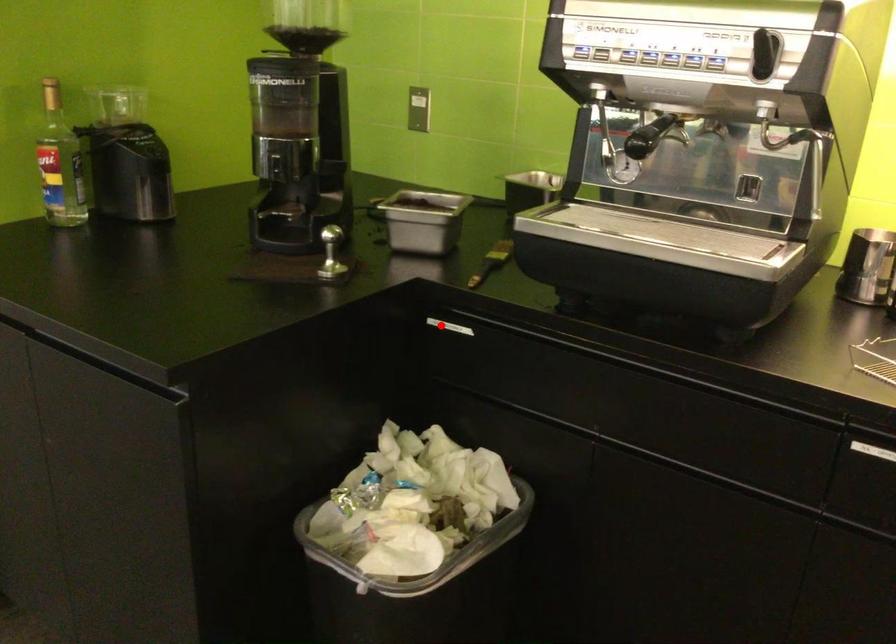
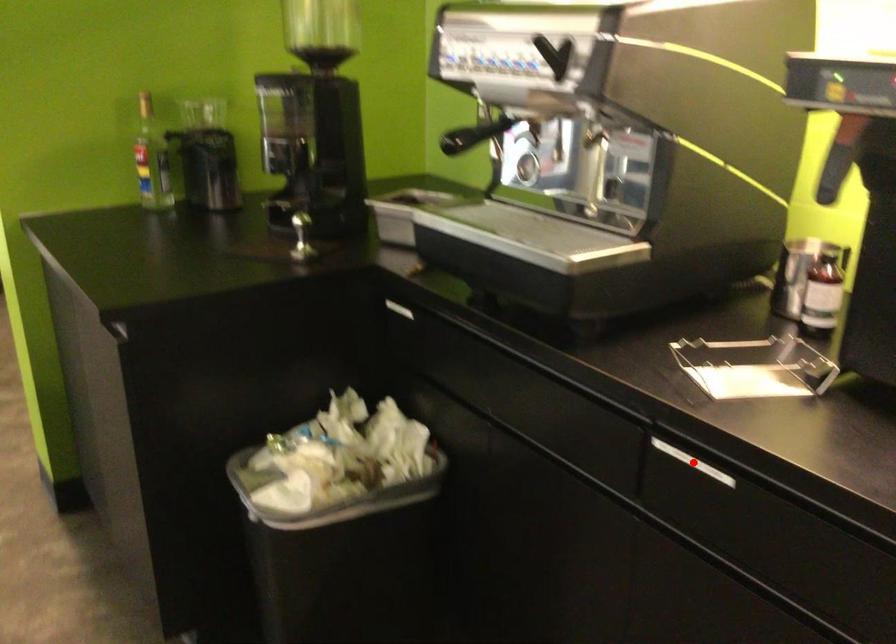
I am providing you with two images of the same scene from different viewpoints. A red point is marked on the first image and another point is marked on the second image. Do the highlighted points in image1 and image2 indicate the same real-world spot?

No